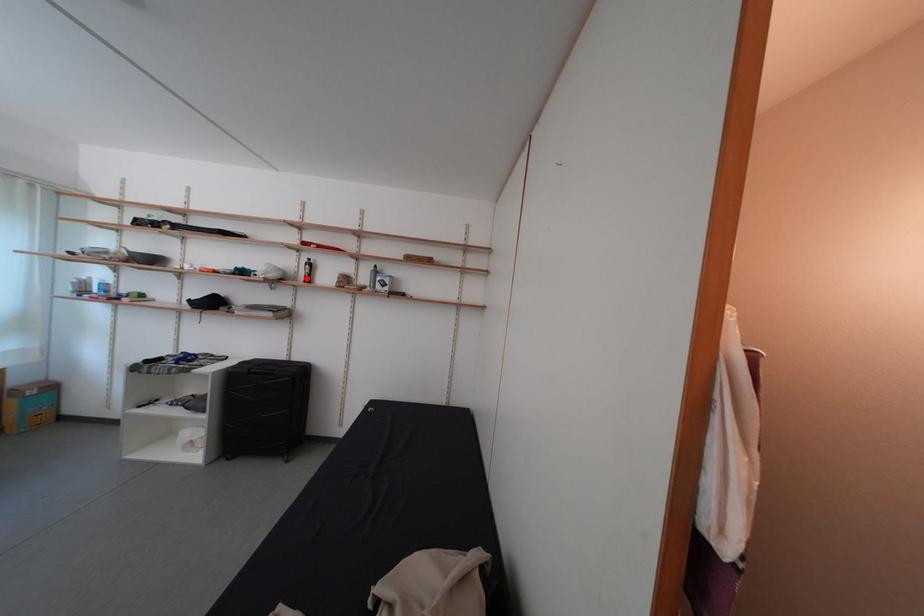
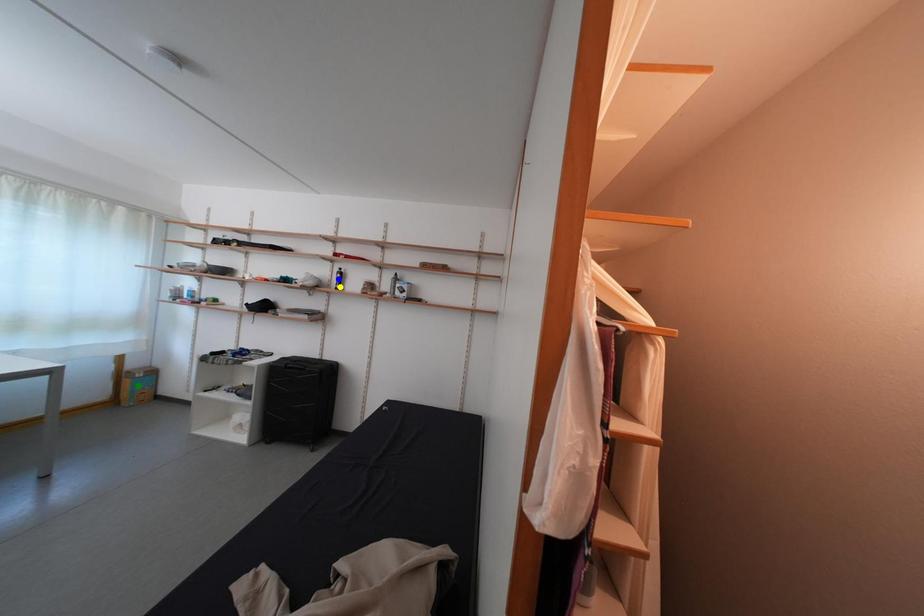
Question: I am providing you with two images of the same scene from different viewpoints. A red point is marked on the first image. You are given multiple points on the second image. Which mark in image 2 goes with the point in image 1?

Choices:
 (A) green point
 (B) blue point
 (C) yellow point

Answer: (C)